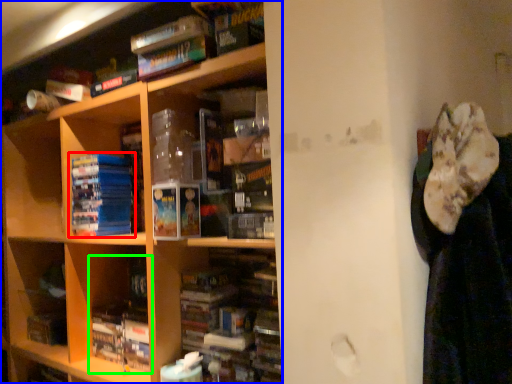
Question: Based on their relative distances, which object is nearer to book (highlighted by a red box)? Choose from shelf (highlighted by a blue box) and book (highlighted by a green box).

Choices:
 (A) shelf
 (B) book

Answer: (A)